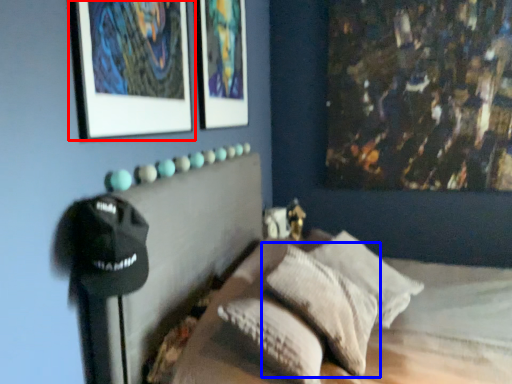
Question: Which of the following is the closest to the observer, picture frame (highlighted by a red box) or pillow (highlighted by a blue box)?

Choices:
 (A) picture frame
 (B) pillow

Answer: (A)